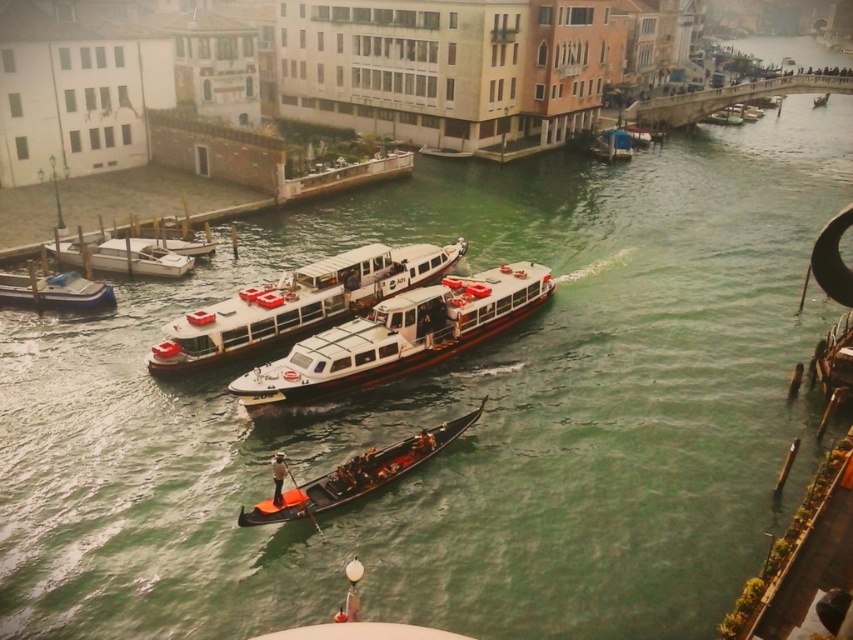
Does white glossy ferry boat at center appear on the right side of matte white boat at lower left?

Indeed, white glossy ferry boat at center is positioned on the right side of matte white boat at lower left.

Does white glossy ferry boat at center have a greater height compared to matte white boat at lower left?

Indeed, white glossy ferry boat at center has a greater height compared to matte white boat at lower left.

Who is more distant from viewer, (360, 372) or (105, 292)?

The point (105, 292) is behind.

Where is `white glossy ferry boat at center`? white glossy ferry boat at center is located at coordinates (399, 336).

Can you confirm if wooden polished gondola at center is positioned to the left of white glossy boat at left?

No, wooden polished gondola at center is not to the left of white glossy boat at left.

Which is behind, point (329, 480) or point (158, 266)?

The point (158, 266) is behind.

Identify the location of wooden polished gondola at center. (358, 474).

Between white glossy boat at center and metallic silver boat at upper right, which one is positioned higher?

metallic silver boat at upper right is higher up.

The height and width of the screenshot is (640, 853). Describe the element at coordinates (299, 301) in the screenshot. I see `white glossy boat at center` at that location.

Where is `white glossy boat at center`? white glossy boat at center is located at coordinates (299, 301).